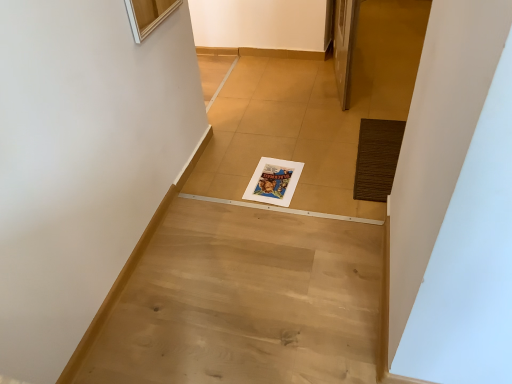
Locate an element on the screen. free location above light wood floor at center (from a real-world perspective) is located at coordinates (273, 285).